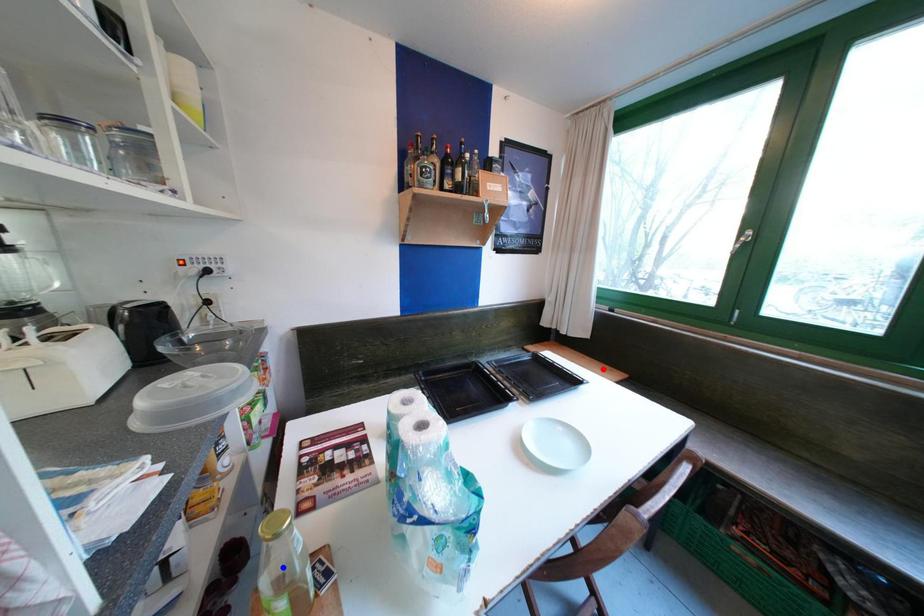
Question: Two points are marked on the image. Which point is closer to the camera?

Choices:
 (A) Blue point is closer.
 (B) Red point is closer.

Answer: (A)